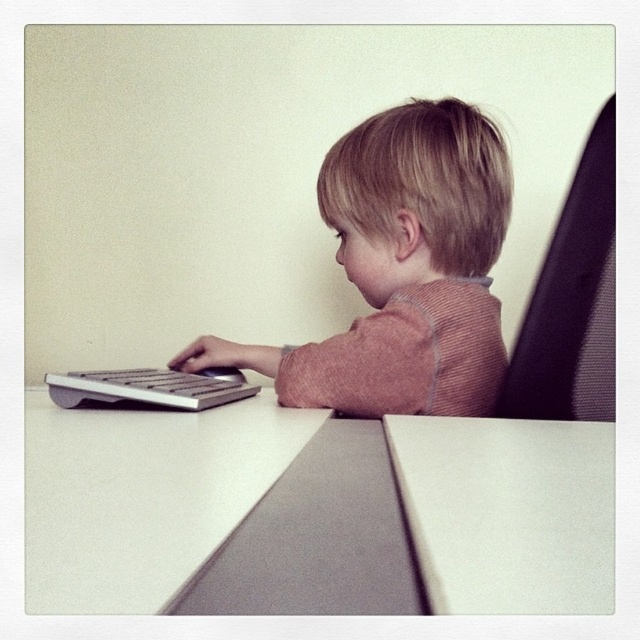
Question: Can you confirm if light brown corduroy toddler at center is positioned below white matte table at lower left?

Choices:
 (A) no
 (B) yes

Answer: (A)

Question: Which of the following is the farthest from the observer?

Choices:
 (A) (40, 440)
 (B) (538, 472)
 (C) (344, 346)
 (D) (211, 400)

Answer: (C)

Question: Which point appears closest to the camera in this image?

Choices:
 (A) (60, 406)
 (B) (339, 250)
 (C) (131, 612)
 (D) (470, 611)

Answer: (D)

Question: Which point is closer to the camera taking this photo?

Choices:
 (A) (333, 355)
 (B) (419, 564)

Answer: (B)

Question: Is white matte table at lower left wider than white matte table at lower center?

Choices:
 (A) no
 (B) yes

Answer: (B)

Question: Can you confirm if light brown corduroy toddler at center is wider than white matte table at lower left?

Choices:
 (A) yes
 (B) no

Answer: (A)